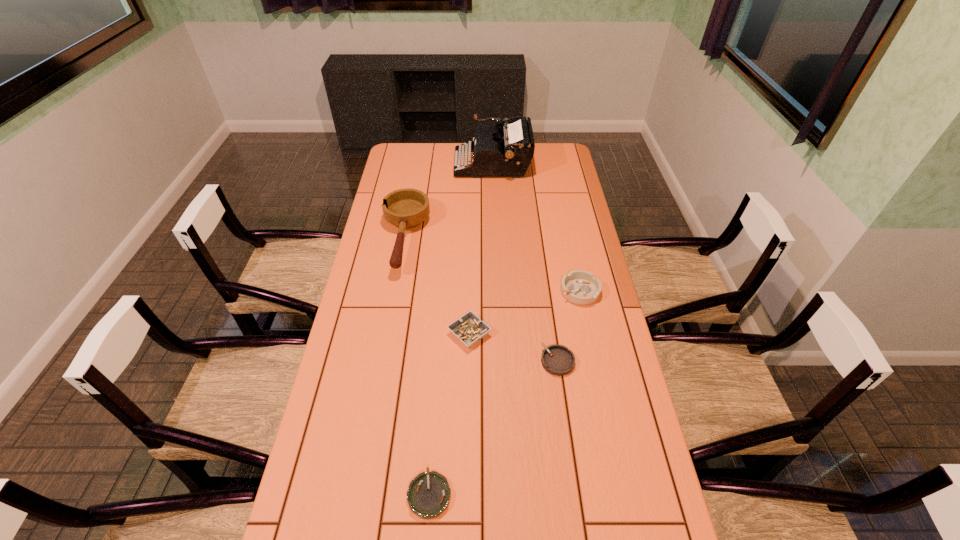
Find the location of a particular element. The image size is (960, 540). vacant position located 0.250m on the typing side of the farthest object is located at coordinates (403, 164).

Image resolution: width=960 pixels, height=540 pixels. Find the location of `vacant space situated 0.390m with the handle on the side of the saucepan`. vacant space situated 0.390m with the handle on the side of the saucepan is located at coordinates tap(380, 371).

I want to click on vacant space situated 0.330m on the left of the fourth shortest object, so click(468, 291).

You are a GUI agent. You are given a task and a screenshot of the screen. Output one action in this format:
    pyautogui.click(x=<x>, y=<y>)
    Task: Click on the vacant space situated 0.230m on the right of the shortest object
    Image resolution: width=960 pixels, height=540 pixels.
    Given the screenshot: What is the action you would take?
    pyautogui.click(x=543, y=494)

You are a GUI agent. You are given a task and a screenshot of the screen. Output one action in this format:
    pyautogui.click(x=<x>, y=<y>)
    Task: Click on the object present at the far edge
    
    Given the screenshot: What is the action you would take?
    pyautogui.click(x=507, y=151)

Find the location of a particular element. object that is positioned at the left edge is located at coordinates (407, 208).

I want to click on free region at the left edge of the desktop, so click(x=376, y=279).

Where is `free space at the right edge of the desktop`? Image resolution: width=960 pixels, height=540 pixels. free space at the right edge of the desktop is located at coordinates (586, 364).

The image size is (960, 540). Identify the location of blank space at the far left corner of the desktop. (416, 162).

The image size is (960, 540). In the image, there is a desktop. What are the coordinates of `free space at the far right corner` in the screenshot? It's located at (539, 156).